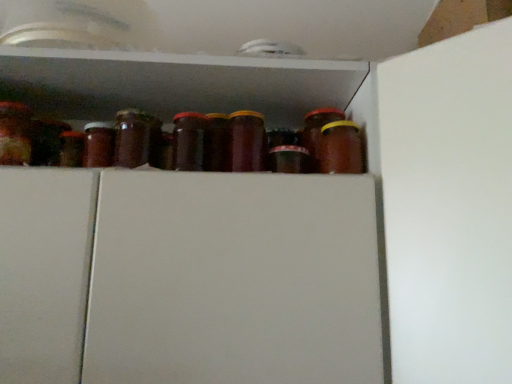
Question: Considering the positions of brown glass jar at center-right, which is the first bottle from right to left, and brown glass jar at center, which is counted as the 1th bottle, starting from the left, in the image, is brown glass jar at center-right, which is the first bottle from right to left, taller or shorter than brown glass jar at center, which is counted as the 1th bottle, starting from the left,?

Choices:
 (A) tall
 (B) short

Answer: (B)

Question: Does point (322, 152) appear closer or farther from the camera than point (239, 168)?

Choices:
 (A) farther
 (B) closer

Answer: (A)

Question: Relative to brown glass jar at center, acting as the second bottle starting from the right, is brown glass jar at center-right, which is the 2th bottle in left-to-right order, in front or behind?

Choices:
 (A) behind
 (B) front

Answer: (A)

Question: Relative to brown glass jar at center-right, which is the 2th bottle in left-to-right order, is brown glass jar at center, which is counted as the 1th bottle, starting from the left, in front or behind?

Choices:
 (A) behind
 (B) front

Answer: (B)

Question: Based on their sizes in the image, would you say brown glass jar at center, which is counted as the 1th bottle, starting from the left, is bigger or smaller than brown glass jar at center-right, which is the first bottle from right to left?

Choices:
 (A) big
 (B) small

Answer: (A)

Question: From the image's perspective, relative to brown glass jar at center-right, which is the 2th bottle in left-to-right order, is brown glass jar at center, acting as the second bottle starting from the right, above or below?

Choices:
 (A) above
 (B) below

Answer: (A)

Question: Based on their positions, is brown glass jar at center, acting as the second bottle starting from the right, located to the left or right of brown glass jar at center-right, which is the 2th bottle in left-to-right order?

Choices:
 (A) left
 (B) right

Answer: (A)